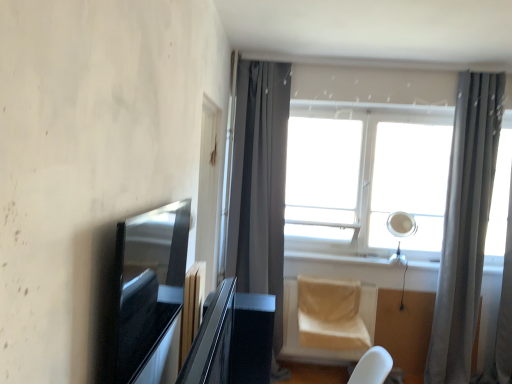
Question: From the image's perspective, relative to gray sheer curtain at right, the 1th curtain viewed from the right, is white plastic window sill at center above or below?

Choices:
 (A) below
 (B) above

Answer: (A)

Question: Is point (296, 258) closer or farther from the camera than point (486, 148)?

Choices:
 (A) farther
 (B) closer

Answer: (A)

Question: Which of these objects is positioned closest to the glossy black table at center?

Choices:
 (A) white glass window at center
 (B) white plastic window sill at center
 (C) dark gray fabric curtain at center, the 1th curtain viewed from the left
 (D) gray sheer curtain at right, the 1th curtain viewed from the right
 (E) beige fabric swivel chair at lower center

Answer: (E)

Question: Based on their relative distances, which object is farther from the gray sheer curtain at right, which is counted as the 2th curtain, starting from the left?

Choices:
 (A) dark gray fabric curtain at center, the 1th curtain viewed from the left
 (B) beige fabric swivel chair at lower center
 (C) white glass window at center
 (D) glossy black table at center
 (E) white plastic window sill at center

Answer: (D)